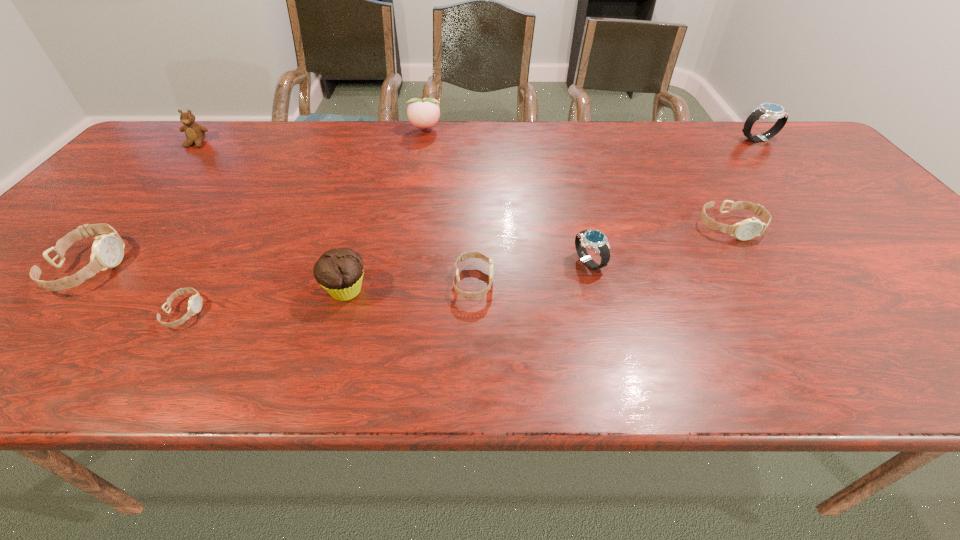
The image size is (960, 540). Find the location of `vacant space in between the peach and the farthest watch`. vacant space in between the peach and the farthest watch is located at coordinates (591, 134).

Where is `free space between the fourth object from left to right and the fifth object from left to right`? free space between the fourth object from left to right and the fifth object from left to right is located at coordinates (386, 210).

The image size is (960, 540). I want to click on vacant space that's between the right silver watch and the teddy bear, so click(x=477, y=141).

Find the location of a particular element. The height and width of the screenshot is (540, 960). unoccupied area between the seventh object from left to right and the bigger silver watch is located at coordinates (673, 200).

Where is `free space between the third beige watch from right to left and the tallest watch`? The width and height of the screenshot is (960, 540). free space between the third beige watch from right to left and the tallest watch is located at coordinates (470, 226).

Locate an element on the screen. empty space that is in between the muffin and the leftmost watch is located at coordinates (218, 279).

Find the location of a particular element. free space between the smaller silver watch and the third smallest beige watch is located at coordinates (660, 245).

You are a GUI agent. You are given a task and a screenshot of the screen. Output one action in this format:
    pyautogui.click(x=<x>, y=<y>)
    Task: Click on the free point between the fourth object from left to right and the fifth object from left to right
    This screenshot has width=960, height=540.
    Given the screenshot: What is the action you would take?
    [x=386, y=210]

Image resolution: width=960 pixels, height=540 pixels. Find the location of `free spot between the fourth object from left to right and the leftmost watch`. free spot between the fourth object from left to right and the leftmost watch is located at coordinates (218, 279).

I want to click on the closest object to the teddy bear, so click(x=107, y=250).